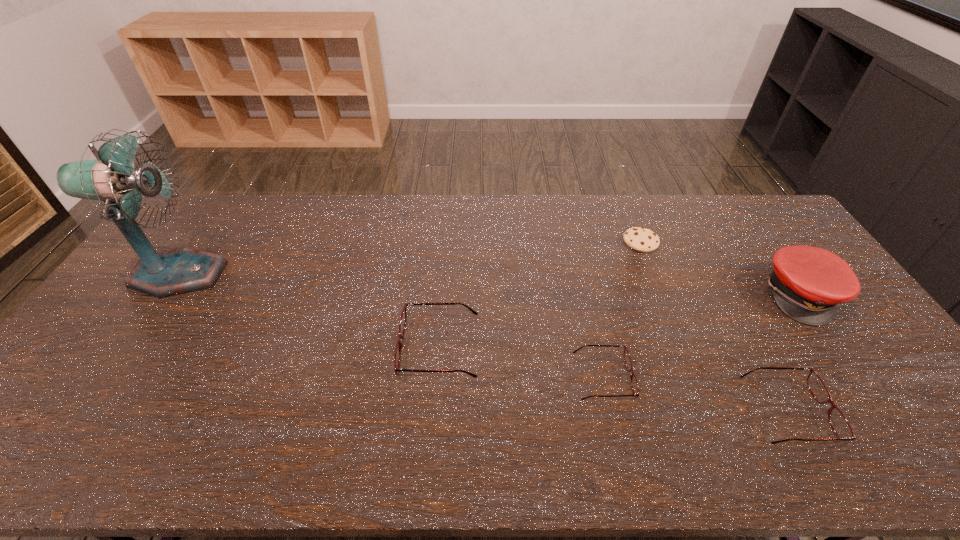
Locate an element on the screen. the second tallest object is located at coordinates (807, 283).

Identify the location of free space located 0.250m on the lenses of the third tallest object. This screenshot has width=960, height=540. (307, 348).

Locate an element on the screen. vacant region located 0.120m on the lenses of the third tallest object is located at coordinates (355, 348).

Image resolution: width=960 pixels, height=540 pixels. I want to click on vacant space located 0.380m on the lenses of the third tallest object, so click(x=259, y=348).

This screenshot has width=960, height=540. Identify the location of free space located 0.170m on the lenses of the shortest spectacles. (697, 378).

Identify the location of free region located 0.110m on the lenses of the second shortest spectacles. This screenshot has width=960, height=540. (870, 411).

Where is `vacant area situated on the back of the cookie`? This screenshot has height=540, width=960. vacant area situated on the back of the cookie is located at coordinates (631, 217).

Where is `vacant space situated 0.120m in front of the tallest object where the wind blows`? vacant space situated 0.120m in front of the tallest object where the wind blows is located at coordinates (259, 274).

I want to click on free spot located 0.080m on the front of the fifth shortest object with an emblem, so click(840, 349).

You are a GUI agent. You are given a task and a screenshot of the screen. Output one action in this format:
    pyautogui.click(x=<x>, y=<y>)
    Task: Click on the object that is at the far edge
    The image size is (960, 540).
    Given the screenshot: What is the action you would take?
    pyautogui.click(x=644, y=240)